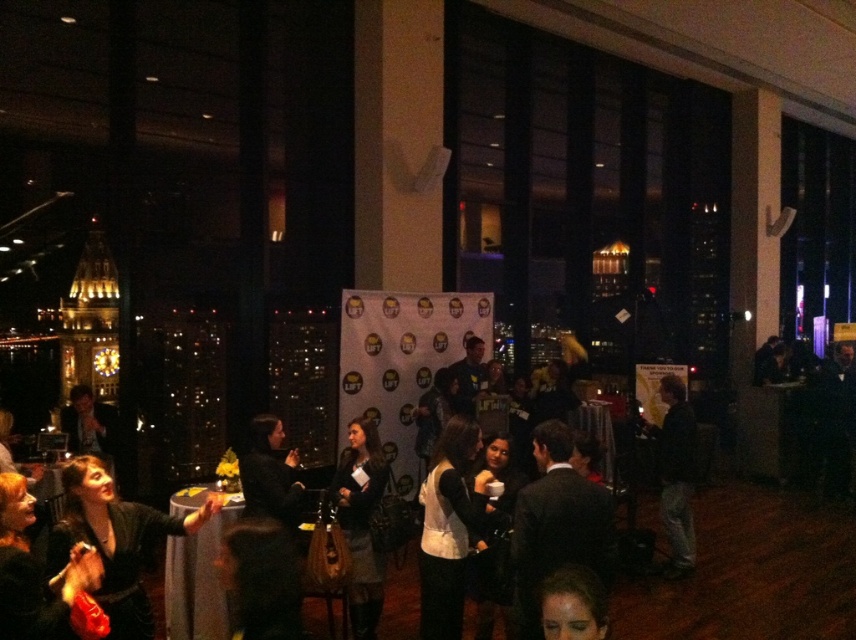
Question: Among these points, which one is farthest from the camera?

Choices:
 (A) click(x=465, y=547)
 (B) click(x=562, y=536)

Answer: (A)

Question: Can you confirm if dark suit at center is positioned to the right of smooth skin face at center?

Choices:
 (A) no
 (B) yes

Answer: (B)

Question: Which is farther from the white matte vest at center?

Choices:
 (A) smooth skin face at center
 (B) dark suit at center

Answer: (A)

Question: Which object appears farthest from the camera in this image?

Choices:
 (A) white matte vest at center
 (B) dark gray suit at center
 (C) dark gray fabric dress at center

Answer: (B)

Question: Is dark gray fabric dress at center bigger than dark gray suit at center?

Choices:
 (A) no
 (B) yes

Answer: (B)

Question: Is velvet black dress at lower left bigger than dark gray fabric dress at center?

Choices:
 (A) yes
 (B) no

Answer: (A)